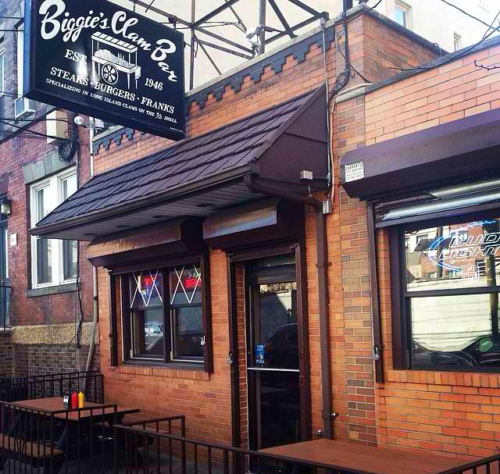
Locate an element on the screen. This screenshot has width=500, height=474. windows is located at coordinates (42, 258), (71, 255), (163, 345), (214, 334), (457, 324), (484, 261).